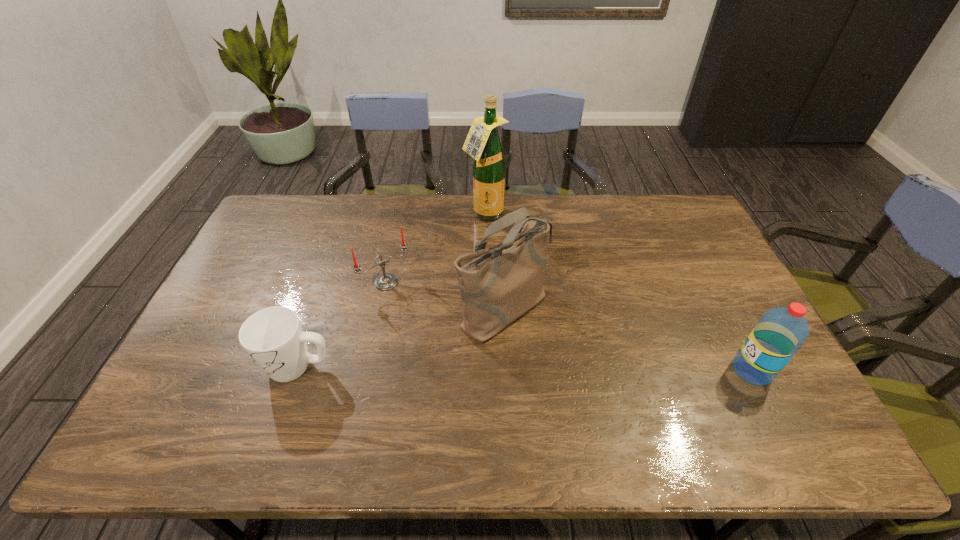
This screenshot has height=540, width=960. What are the coordinates of `vacant space at the far right corner` in the screenshot? It's located at (694, 225).

Where is `free space between the candle and the water bottle`? free space between the candle and the water bottle is located at coordinates (569, 327).

Where is `free area in between the liquor and the mug`? The width and height of the screenshot is (960, 540). free area in between the liquor and the mug is located at coordinates (392, 291).

At what (x,y) coordinates should I click in order to perform the action: click on free area in between the fourth shortest object and the leftmost object. Please return your answer as a coordinate pair (x, y). The height and width of the screenshot is (540, 960). Looking at the image, I should click on [401, 338].

Locate an element on the screen. Image resolution: width=960 pixels, height=540 pixels. vacant space in between the candle and the third tallest object is located at coordinates (569, 327).

Where is `vacant region between the water bottle and the farthest object`? The image size is (960, 540). vacant region between the water bottle and the farthest object is located at coordinates (618, 293).

Locate an element on the screen. vacant space that is in between the liquor and the fourth object from right to left is located at coordinates (435, 248).

The image size is (960, 540). I want to click on free space between the third tallest object and the leftmost object, so click(x=525, y=368).

The image size is (960, 540). I want to click on unoccupied position between the leftmost object and the second object from left to right, so pyautogui.click(x=343, y=325).

The width and height of the screenshot is (960, 540). Identify the location of the closest object to the leftmost object. (386, 281).